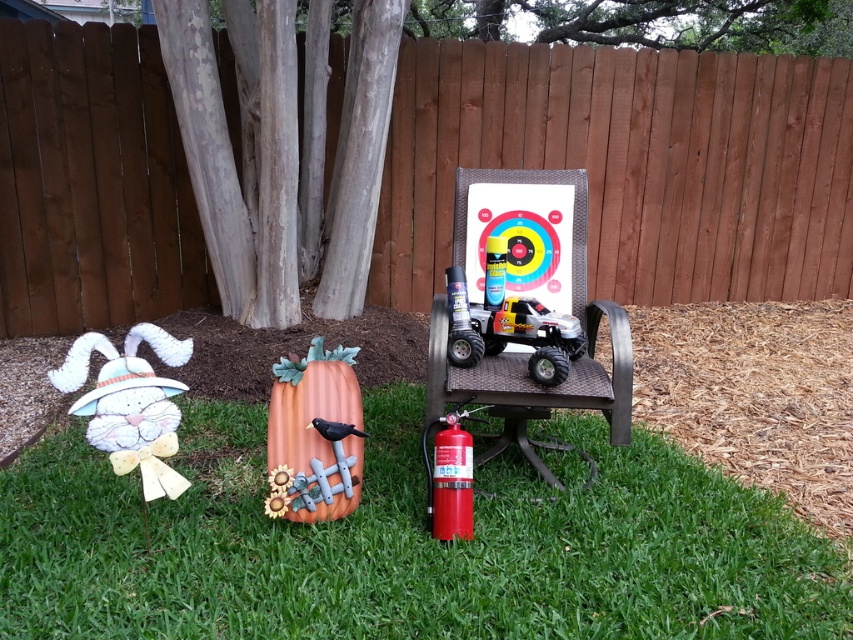
You are a child trying to see over the brown wood fence at upper center while standing next to the white fabric bunny at left. Can you see over the fence if you stand on the bunny?

The brown wood fence at upper center is much taller than the white fabric bunny at left, so standing on the bunny would not allow you to see over the fence.

You are standing in the backyard looking at the brown wood fence at upper center and the green grass at lower left. Which object is taller?

The brown wood fence at upper center is taller than the green grass at lower left.

Based on the photo, you are standing in the backyard and want to throw a ball to hit the target board with concentric circles on the wicker chair. Considering the distance between you and the brown wood fence at upper center, can you estimate whether you can reach the target board?

The distance between you and the brown wood fence at upper center is 4.31 meters. Since the target board is located on the wicker chair to the right of the red fire extinguisher, which is in front of the fence, the target board is likely within your throwing range. However, the exact reach depends on your throwing strength, but the distance to the fence suggests the target is about 4.31 meters away, so if you can throw that far, you can reach it.